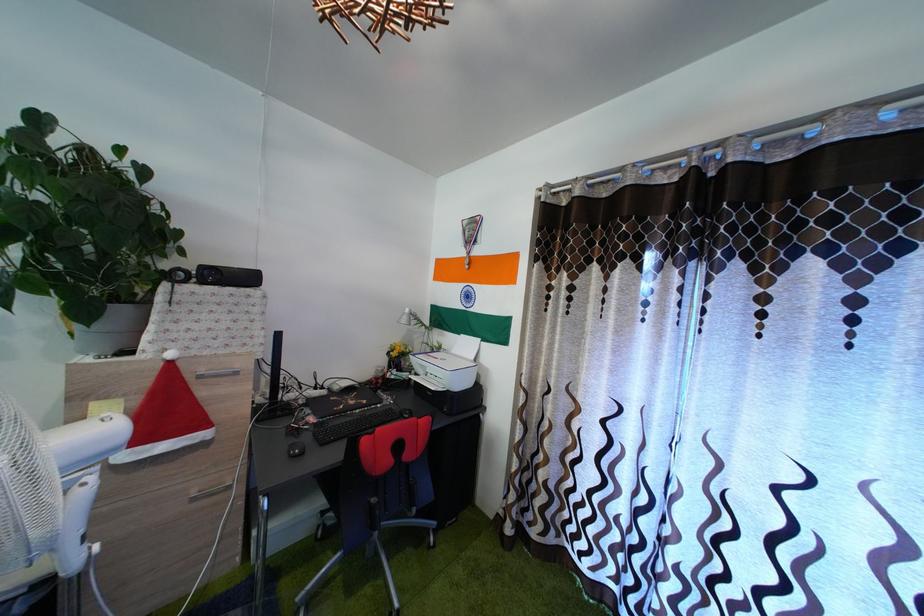
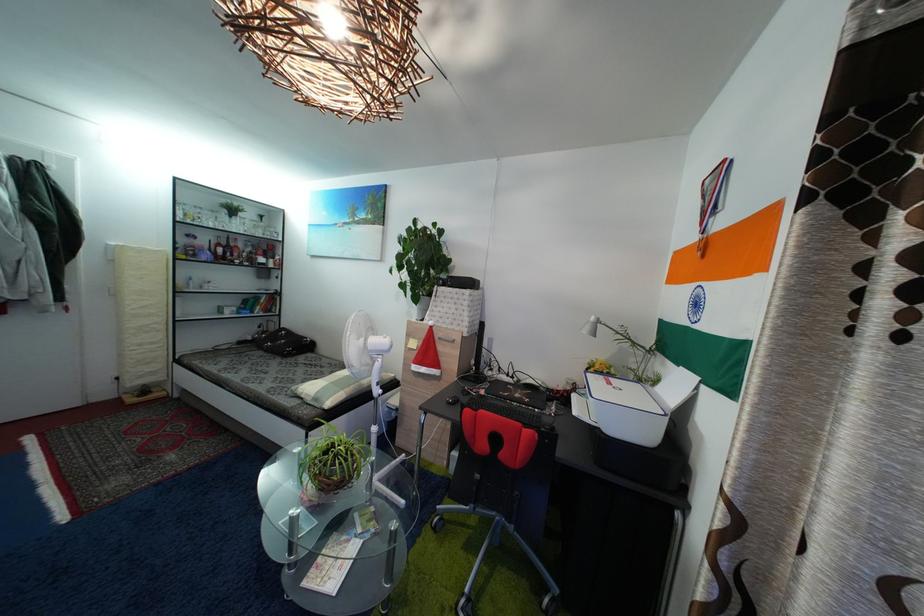
Question: The camera is either moving clockwise (left) or counter-clockwise (right) around the object. The first image is from the beginning of the video and the second image is from the end. Is the camera moving left or right when shooting the video?

Choices:
 (A) Left
 (B) Right

Answer: (B)